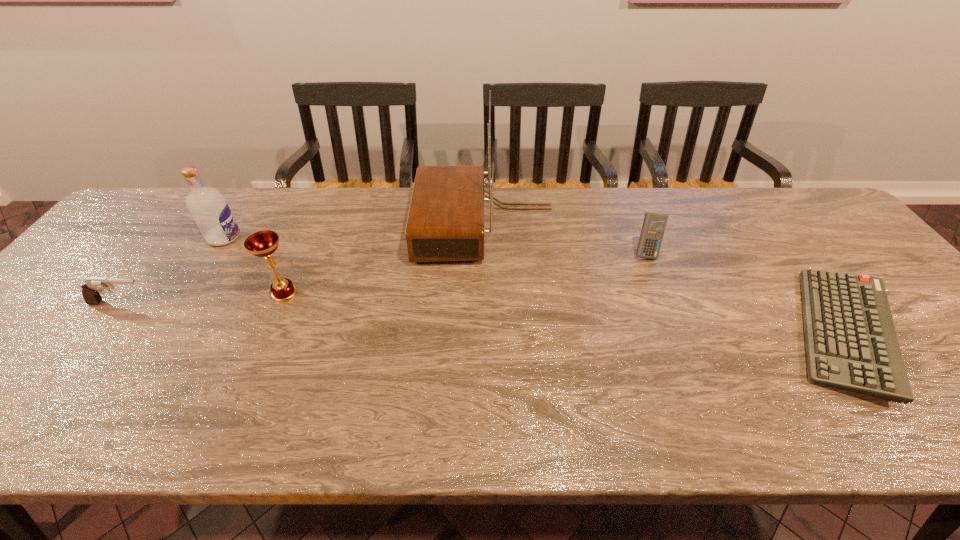
I want to click on free point located on the front panel of the fourth object from left to right, so (305, 226).

Image resolution: width=960 pixels, height=540 pixels. What are the coordinates of `free space located on the front panel of the fourth object from left to right` in the screenshot? It's located at (285, 226).

Identify the location of free location located 0.120m on the front panel of the fourth object from left to right. (375, 226).

This screenshot has height=540, width=960. What are the coordinates of `free spot located on the label of the second object from left to right` in the screenshot? It's located at (369, 238).

Find the location of a particular element. vacant area located on the right of the third object from left to right is located at coordinates (391, 293).

This screenshot has width=960, height=540. I want to click on vacant space situated 0.060m on the front-facing side of the third shortest object, so click(656, 278).

Identify the location of vacant space located 0.340m at the muzzle of the fifth tallest object. This screenshot has width=960, height=540. (289, 303).

The image size is (960, 540). What are the coordinates of `radio_receiver present at the far edge` in the screenshot? It's located at (445, 222).

Image resolution: width=960 pixels, height=540 pixels. Identify the location of vodka situated at the far edge. (209, 209).

Where is `object located at the left edge`? The image size is (960, 540). object located at the left edge is located at coordinates (93, 286).